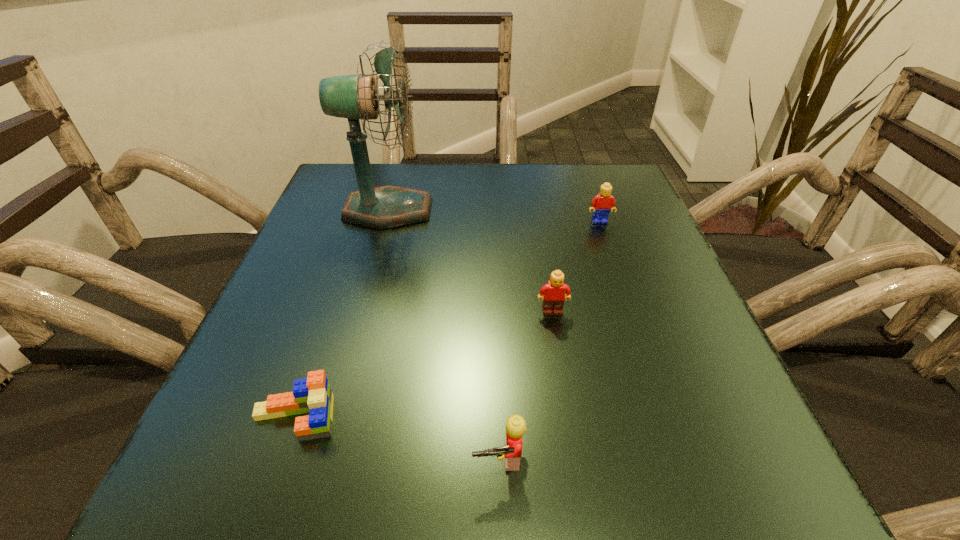
Identify the location of the tallest object. (354, 97).

Locate an element on the screen. This screenshot has width=960, height=540. the rightmost Lego is located at coordinates (601, 204).

Identify the location of the rightmost object. (601, 204).

The width and height of the screenshot is (960, 540). Identify the location of the second object from right to left. (554, 296).

The height and width of the screenshot is (540, 960). Identify the location of the third farthest object. (554, 296).

I want to click on the third object from right to left, so click(515, 425).

Image resolution: width=960 pixels, height=540 pixels. What are the coordinates of `the shortest object` in the screenshot? It's located at (313, 395).

Locate an element on the screen. This screenshot has width=960, height=540. the leftmost Lego is located at coordinates pyautogui.click(x=313, y=395).

Find the location of `free spot located in front of the tallest object where the wind blows`. free spot located in front of the tallest object where the wind blows is located at coordinates (459, 210).

You are a GUI agent. You are given a task and a screenshot of the screen. Output one action in this format:
    pyautogui.click(x=<x>, y=<y>)
    Task: Click on the vacant space located on the front-facing side of the farthest Lego
    The height and width of the screenshot is (540, 960).
    Given the screenshot: What is the action you would take?
    pyautogui.click(x=608, y=245)